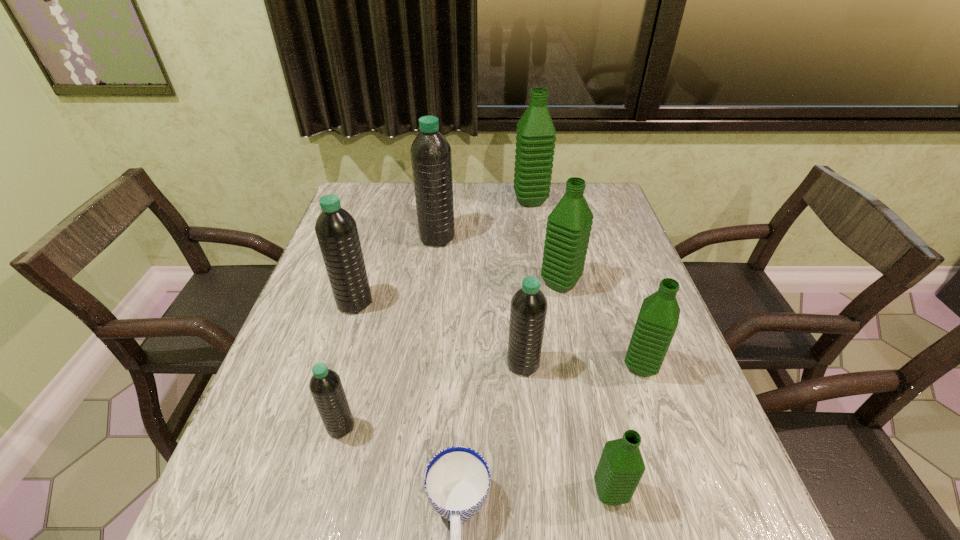
Locate which black water bottle ranks in proximity to the second farthest green water bottle. Please provide its 2D coordinates. Your answer should be formatted as a tuple, i.e. [(x, y)], where the tuple contains the x and y coordinates of a point satisfying the conditions above.

[(528, 309)]

Where is `the closest green water bottle relative to the third nearest green water bottle`? The image size is (960, 540). the closest green water bottle relative to the third nearest green water bottle is located at coordinates (657, 321).

The image size is (960, 540). In order to click on the second closest green water bottle to the rightmost black water bottle in this screenshot , I will do `click(568, 229)`.

Where is `vacant area that satisfies the following two spatial constraints: 1. on the front side of the rightmost water bottle; 2. on the right side of the second smallest black water bottle`? vacant area that satisfies the following two spatial constraints: 1. on the front side of the rightmost water bottle; 2. on the right side of the second smallest black water bottle is located at coordinates tap(523, 366).